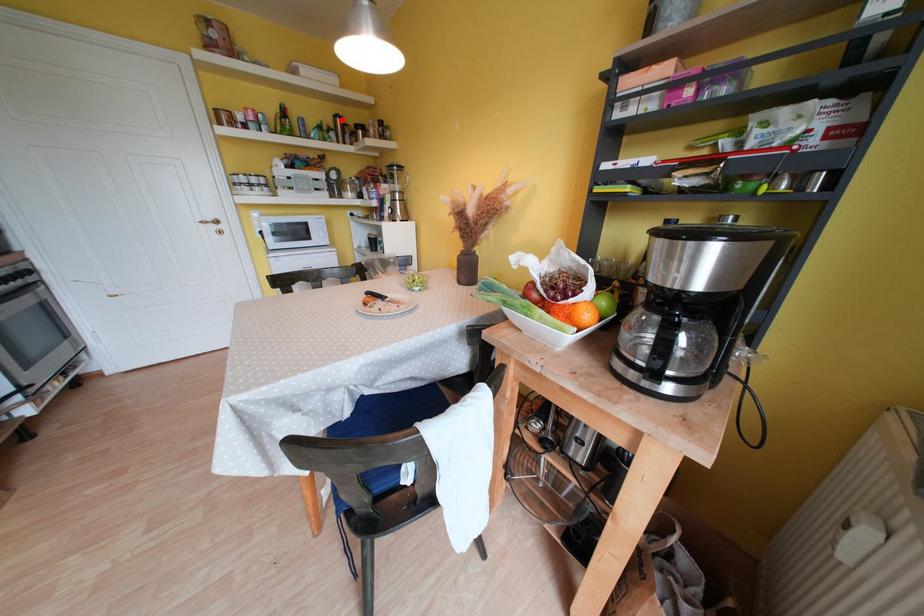
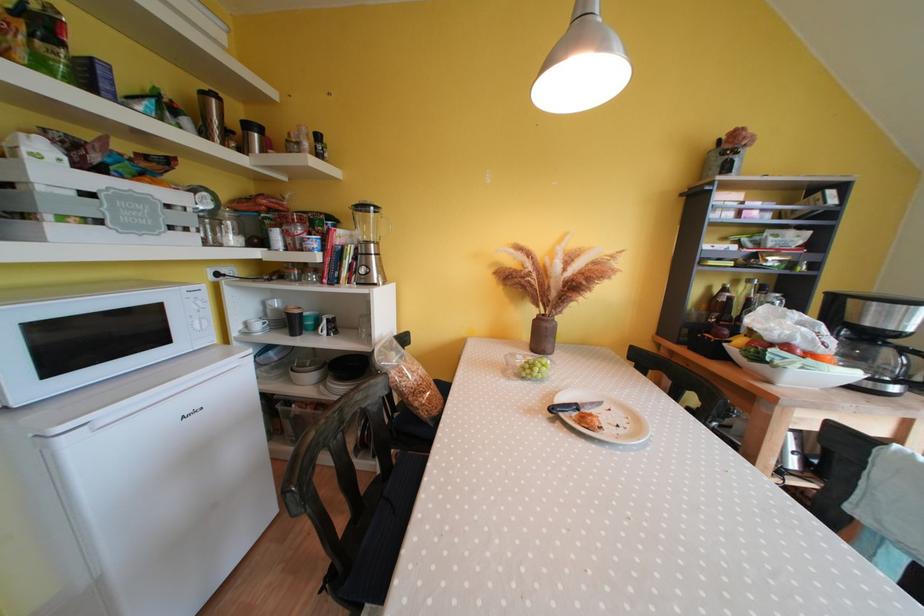
Question: I am providing you with two images of the same scene from different viewpoints. Given a red point in image1, look at the same physical point in image2. Is it:

Choices:
 (A) Closer to the viewpoint
 (B) Farther from the viewpoint

Answer: (B)